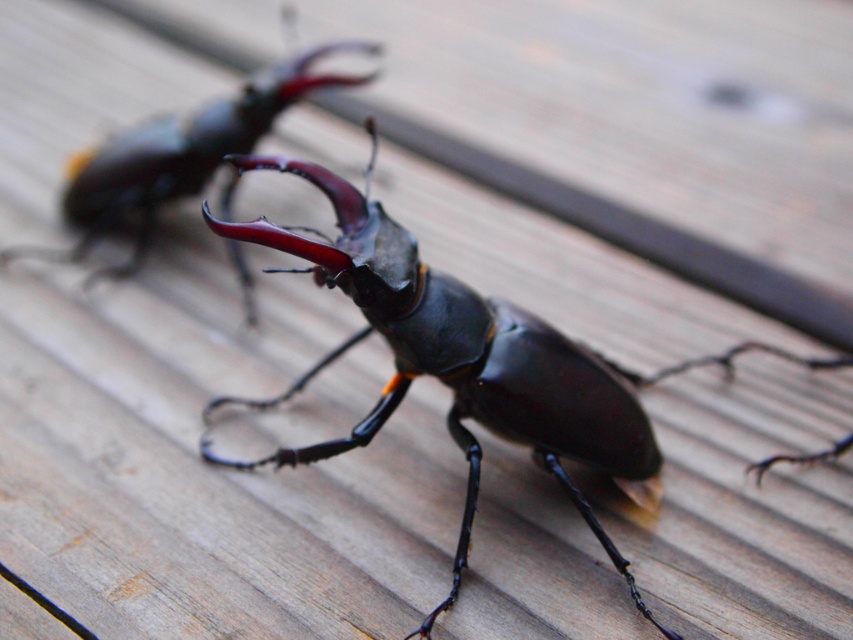
Question: Among these objects, which one is farthest from the camera?

Choices:
 (A) glossy black beetle at center
 (B) shiny black beetle at center

Answer: (A)

Question: Which point is closer to the camera?

Choices:
 (A) (276, 268)
 (B) (113, 208)

Answer: (A)

Question: In this image, where is shiny black beetle at center located relative to glossy black beetle at center?

Choices:
 (A) right
 (B) left

Answer: (A)

Question: Does shiny black beetle at center appear on the right side of glossy black beetle at center?

Choices:
 (A) yes
 (B) no

Answer: (A)

Question: Can you confirm if shiny black beetle at center is positioned to the left of glossy black beetle at center?

Choices:
 (A) no
 (B) yes

Answer: (A)